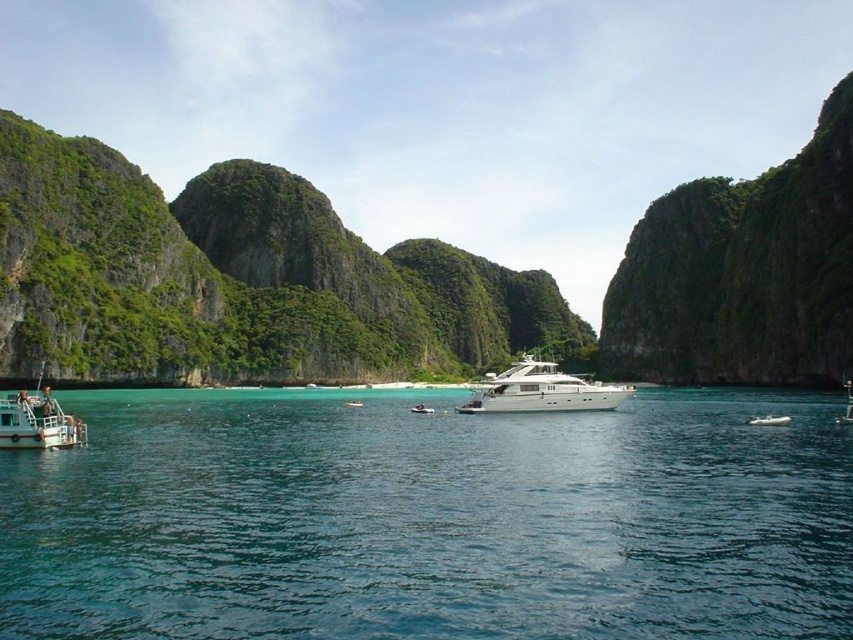
Looking at this image, who is higher up, white glossy yacht at center or white glossy boat at center?

white glossy yacht at center is above.

Between white glossy yacht at center and white glossy boat at center, which one is positioned lower?

white glossy boat at center

Is point (534, 376) positioned after point (421, 412)?

No, it is in front of (421, 412).

The height and width of the screenshot is (640, 853). I want to click on white glossy yacht at center, so click(x=541, y=390).

Which is above, clear blue water at center or white glossy boat at lower left?

white glossy boat at lower left is higher up.

Does point (120, 499) come closer to viewer compared to point (12, 435)?

Yes, it is in front of point (12, 435).

Identify the location of clear blue water at center. The width and height of the screenshot is (853, 640). (430, 518).

Can you confirm if white glossy boat at lower left is smaller than white glossy motorboat at center?

Actually, white glossy boat at lower left might be larger than white glossy motorboat at center.

Identify the location of white glossy boat at lower left. Image resolution: width=853 pixels, height=640 pixels. (38, 420).

Where is `white glossy boat at lower left`? white glossy boat at lower left is located at coordinates (38, 420).